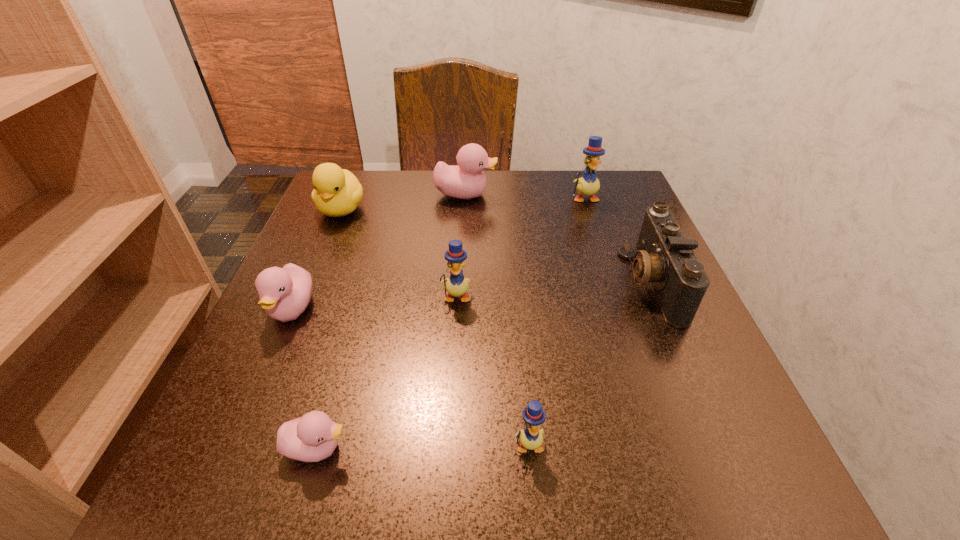
Locate an element on the screen. This screenshot has width=960, height=540. the sixth object from left to right is located at coordinates (531, 438).

Where is `the smallest yellow duckling`? The height and width of the screenshot is (540, 960). the smallest yellow duckling is located at coordinates (531, 438).

At what (x,y) coordinates should I click in order to perform the action: click on the fifth duckling from right to left. Please return your answer as a coordinate pair (x, y). Looking at the image, I should click on (311, 438).

Identify the location of the nearest pink duckling. (311, 438).

Where is `vacant area situated on the face of the biggest yellow duckling, where the monocle is placed`? vacant area situated on the face of the biggest yellow duckling, where the monocle is placed is located at coordinates (629, 333).

At what (x,y) coordinates should I click in order to perform the action: click on blank area located 0.220m on the front-facing side of the biggest pink duckling. Please return your answer as a coordinate pair (x, y). This screenshot has width=960, height=540. Looking at the image, I should click on (588, 194).

Image resolution: width=960 pixels, height=540 pixels. In order to click on vacant position located on the front-facing side of the duck in this screenshot , I will do `click(290, 332)`.

Locate an element on the screen. This screenshot has height=540, width=960. vacant space located 0.330m on the face of the second biggest yellow duckling, where the monocle is placed is located at coordinates (444, 501).

Where is `vacant space located on the front-facing side of the camera`? The image size is (960, 540). vacant space located on the front-facing side of the camera is located at coordinates (540, 282).

The height and width of the screenshot is (540, 960). Identify the location of vacant space situated 0.070m on the front-facing side of the camera. (589, 282).